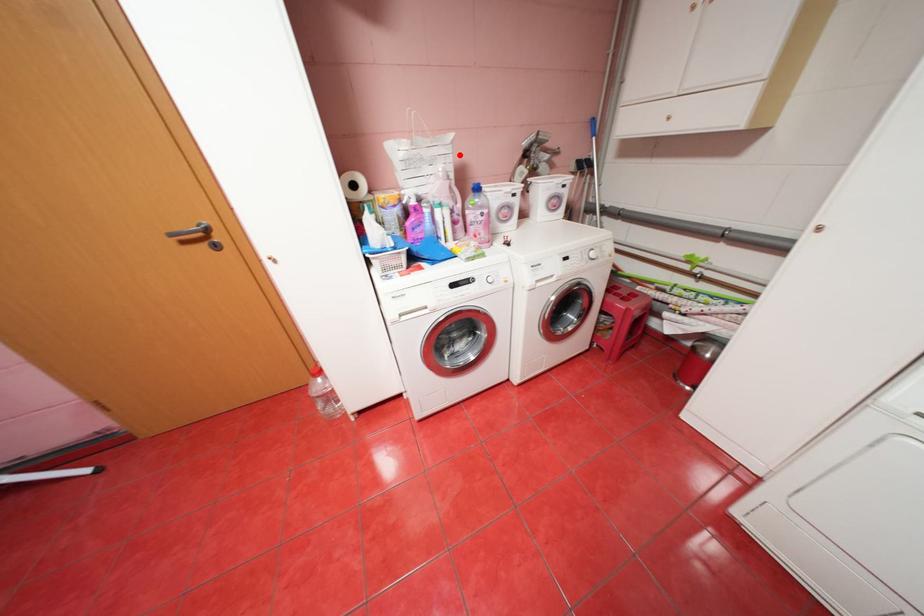
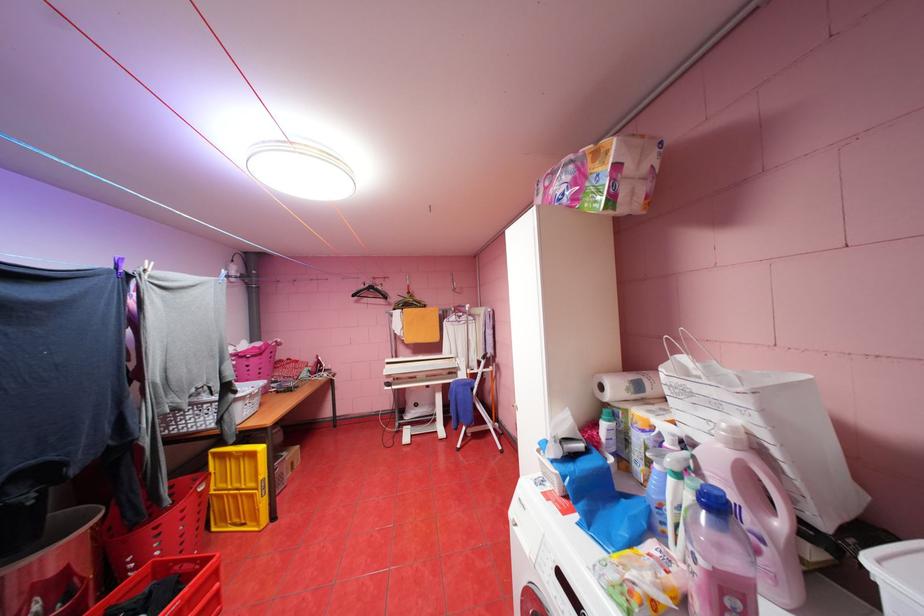
Question: I am providing you with two images of the same scene from different viewpoints. A red point is shown in image1. For the corresponding object point in image2, is it positioned nearer or farther from the camera?

Choices:
 (A) Nearer
 (B) Farther

Answer: (B)